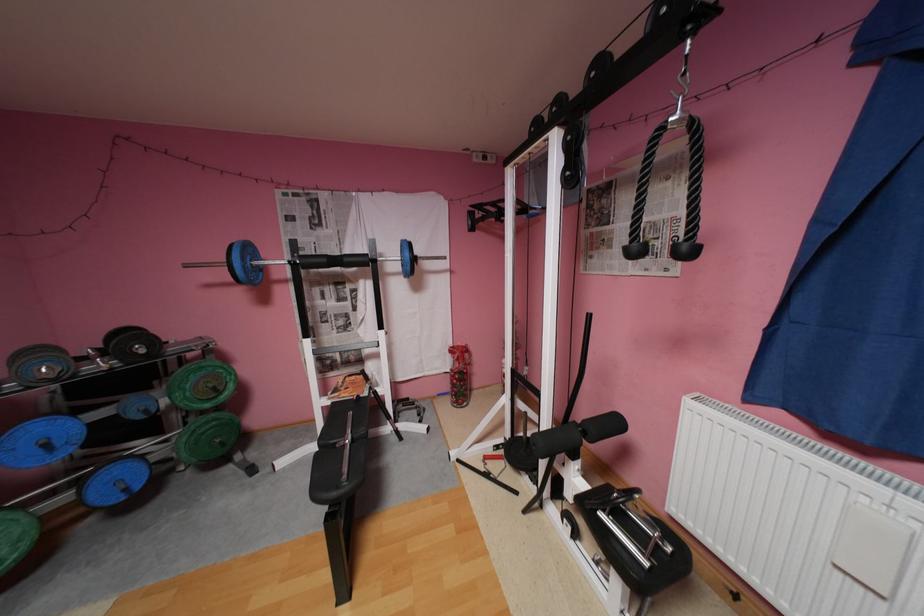
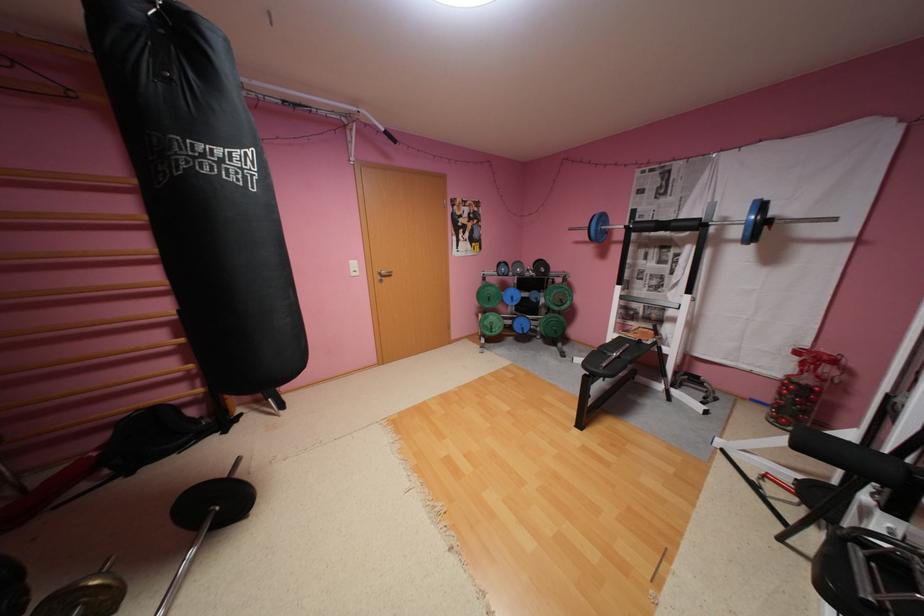
Question: The camera is either moving clockwise (left) or counter-clockwise (right) around the object. The first image is from the beginning of the video and the second image is from the end. Is the camera moving left or right when shooting the video?

Choices:
 (A) Left
 (B) Right

Answer: (B)